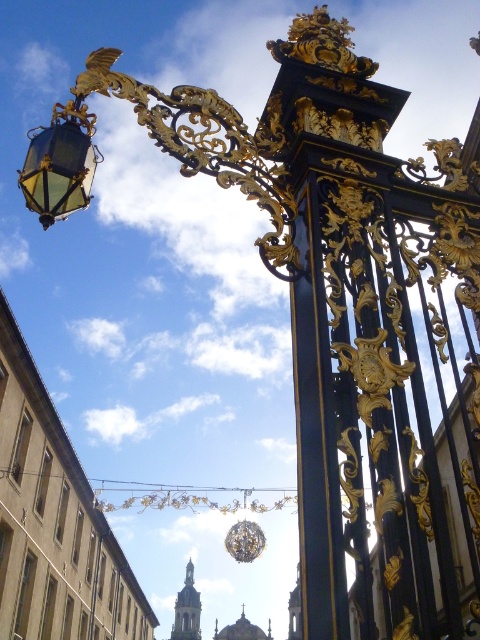
Question: Based on their relative distances, which object is farther from the beige stone building at lower left?

Choices:
 (A) black polished metal gate at center
 (B) gold textured lamp at center

Answer: (A)

Question: Is beige stone building at lower left positioned before gold textured lamp at center?

Choices:
 (A) yes
 (B) no

Answer: (A)

Question: Which object is positioned farthest from the beige stone building at lower left?

Choices:
 (A) matte gold lantern at upper left
 (B) gold textured lamp at center

Answer: (A)

Question: Does beige stone building at lower left have a lesser width compared to black polished metal gate at center?

Choices:
 (A) yes
 (B) no

Answer: (B)

Question: Which of the following is the closest to the observer?

Choices:
 (A) (230, 531)
 (B) (24, 582)

Answer: (B)

Question: Can you confirm if beige stone building at lower left is smaller than matte gold lantern at upper left?

Choices:
 (A) no
 (B) yes

Answer: (A)